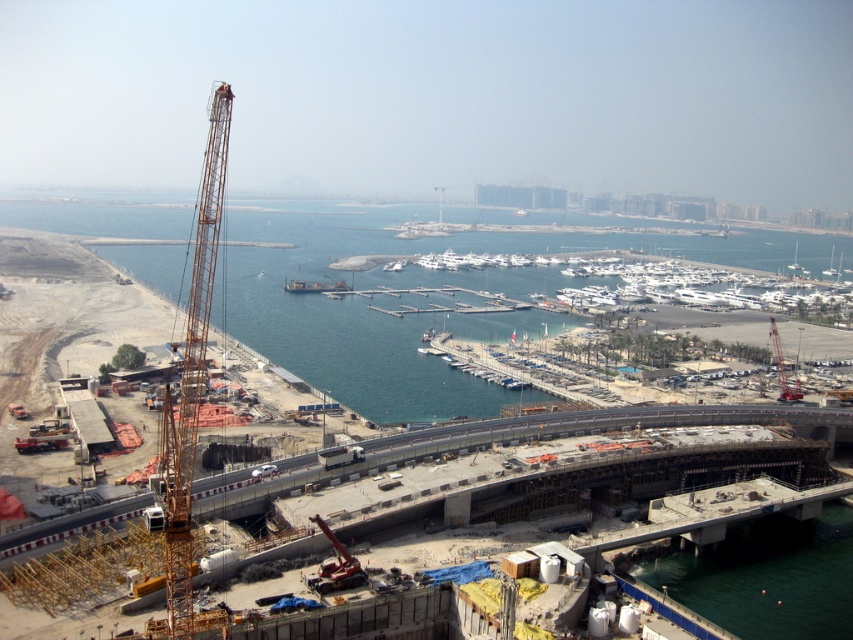
Question: Among these objects, which one is farthest from the camera?

Choices:
 (A) yellow metallic crane at left
 (B) orange construction crane at left

Answer: (B)

Question: Which point is farther to the camera?

Choices:
 (A) (163, 410)
 (B) (677, 598)

Answer: (A)

Question: Can you confirm if orange construction crane at left is positioned to the left of yellow metallic crane at left?

Choices:
 (A) no
 (B) yes

Answer: (B)

Question: Can you confirm if orange construction crane at left is positioned below yellow metallic crane at left?

Choices:
 (A) no
 (B) yes

Answer: (A)

Question: Is orange construction crane at left to the left of yellow metallic crane at left from the viewer's perspective?

Choices:
 (A) yes
 (B) no

Answer: (A)